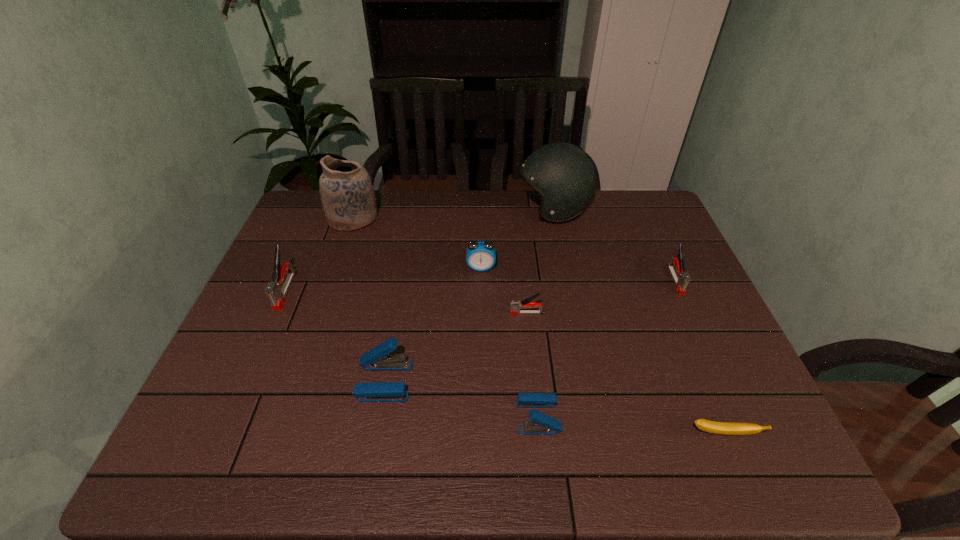
At what (x,y) coordinates should I click in order to perform the action: click on vacant space located on the face of the sixth object from right to left. Please return your answer as a coordinate pair (x, y). This screenshot has height=540, width=960. Looking at the image, I should click on (481, 308).

The image size is (960, 540). In order to click on vacant region located on the right of the fourth stapler from right to left in this screenshot , I will do `click(545, 381)`.

The image size is (960, 540). What are the coordinates of `free location located on the handle side of the sixth farthest object` in the screenshot? It's located at (358, 313).

Find the location of a particular element. The image size is (960, 540). vacant space located on the handle side of the sixth farthest object is located at coordinates (370, 313).

Identify the location of vacant region located on the handle side of the sixth farthest object. This screenshot has height=540, width=960. (419, 313).

Image resolution: width=960 pixels, height=540 pixels. I want to click on vacant space located 0.140m on the back of the smaller blue stapler, so click(531, 349).

This screenshot has height=540, width=960. I want to click on free space located at the stem of the banana, so click(x=738, y=470).

Find the location of `football helmet that is positioned at the far edge`. football helmet that is positioned at the far edge is located at coordinates (563, 175).

The image size is (960, 540). Find the location of `pottery that is at the far edge`. pottery that is at the far edge is located at coordinates (347, 193).

Locate an element on the screen. The height and width of the screenshot is (540, 960). stapler located at the near edge is located at coordinates (541, 424).